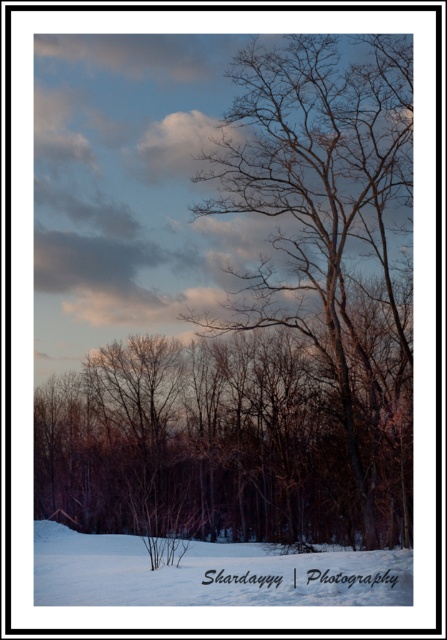
You are standing at the point with coordinates point (171, 579) in the winter landscape. You want to walk towards the point with coordinates point (370, 196). Which direction should you move relative to your current position?

Since point (370, 196) is behind point (171, 579), you should move backward to reach it.

You are standing at the center of the snowy ground and want to place a small ornament exactly at the location of the bare branches at center. What are the coordinates where you should place the ornament?

The bare branches at center is located at point (x=324, y=224), so you should place the ornament at those coordinates.

Consider the image. You are an artist planning to paint this winter scene. You have to decide which area to focus on first based on the size of the objects. Which object should you paint first, the bare branches at center or the white powdery snow at lower left?

The white powdery snow at lower left occupies more space than the bare branches at center, so you should paint the white powdery snow at lower left first to establish the background before adding finer details like the smaller bare branches at center.